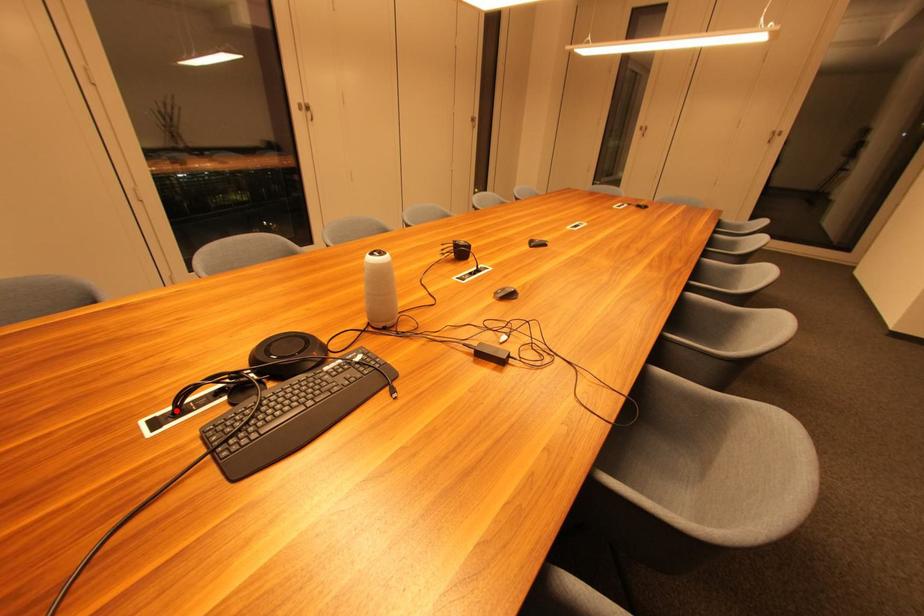
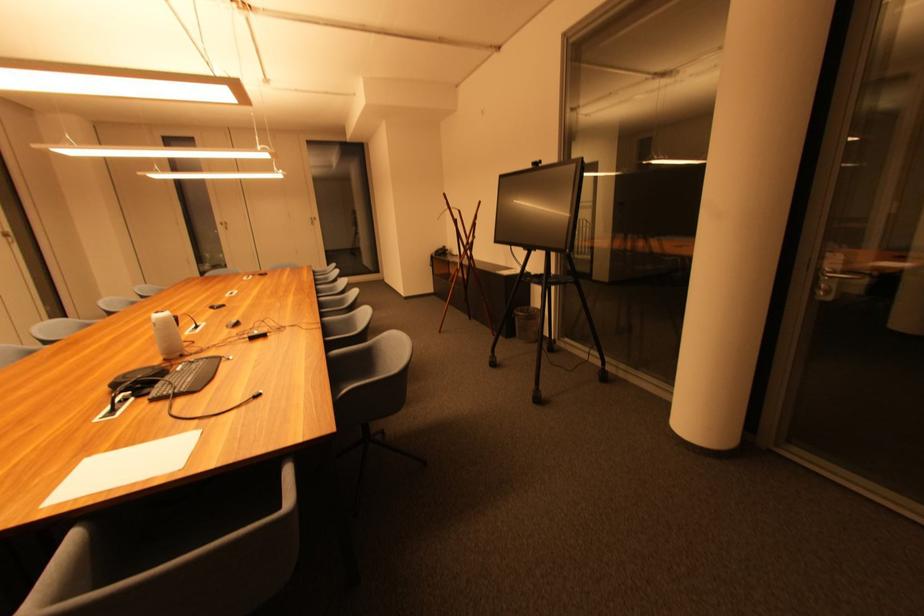
In the second image, find the point that corresponds to the highlighted location in the first image.

(114, 411)